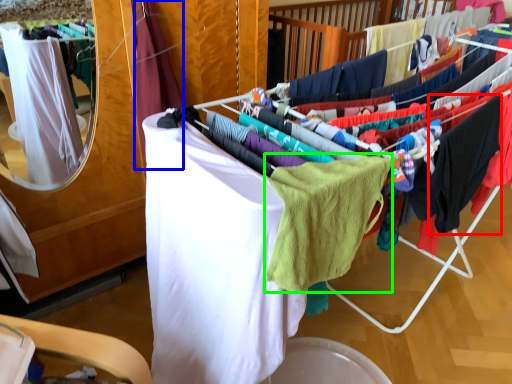
Question: Which object is positioned farthest from clothing (highlighted by a red box)? Select from clothing (highlighted by a blue box) and baby clothe (highlighted by a green box).

Choices:
 (A) clothing
 (B) baby clothe

Answer: (A)